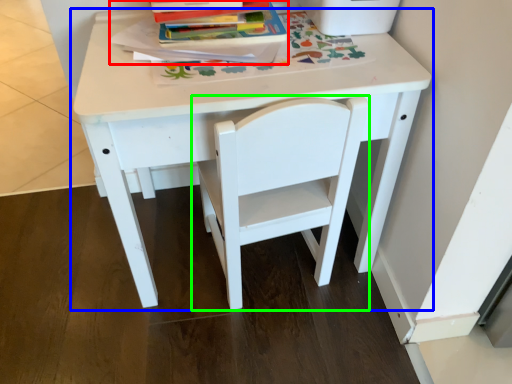
Question: Which object is positioned closest to paperback book (highlighted by a red box)? Select from table (highlighted by a blue box) and chair (highlighted by a green box).

Choices:
 (A) table
 (B) chair

Answer: (A)